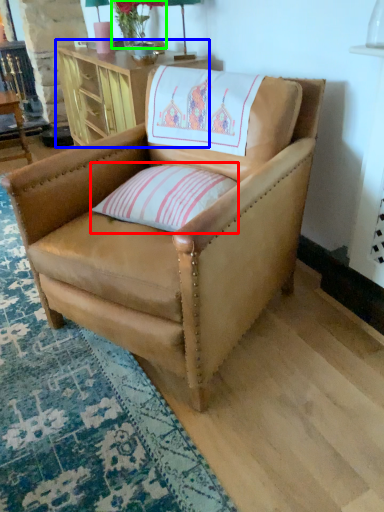
Question: Which object is the closest to the pillow (highlighted by a red box)? Choose among these: table (highlighted by a blue box) or flower (highlighted by a green box).

Choices:
 (A) table
 (B) flower

Answer: (A)